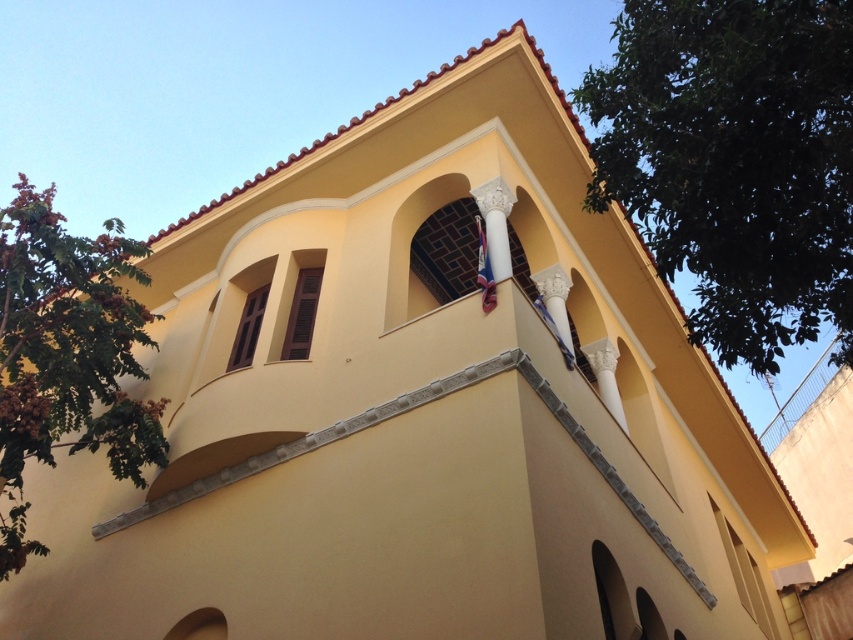
Question: Is green leafy tree at upper right to the right of green leafy tree at left from the viewer's perspective?

Choices:
 (A) no
 (B) yes

Answer: (B)

Question: Which point appears farthest from the camera in this image?

Choices:
 (A) (48, 368)
 (B) (753, 292)

Answer: (A)

Question: Is green leafy tree at upper right below green leafy tree at left?

Choices:
 (A) no
 (B) yes

Answer: (A)

Question: Does green leafy tree at upper right have a lesser width compared to green leafy tree at left?

Choices:
 (A) yes
 (B) no

Answer: (A)

Question: Which point appears farthest from the camera in this image?

Choices:
 (A) (792, 93)
 (B) (15, 536)

Answer: (B)